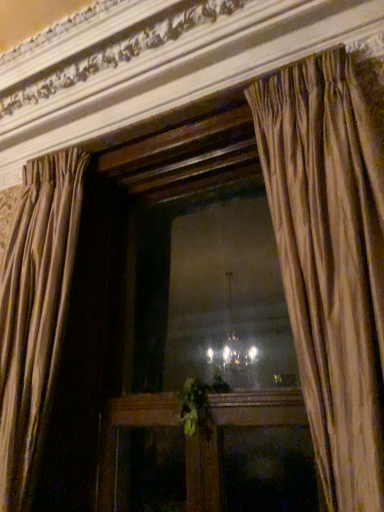
Question: From the image's perspective, is wooden frame at center located above silky beige curtain at center, the first curtain when ordered from right to left?

Choices:
 (A) yes
 (B) no

Answer: (B)

Question: Is wooden frame at center smaller than silky beige curtain at center, which is the 2th curtain in left-to-right order?

Choices:
 (A) yes
 (B) no

Answer: (A)

Question: From a real-world perspective, is wooden frame at center below silky beige curtain at center, which is the 2th curtain in left-to-right order?

Choices:
 (A) yes
 (B) no

Answer: (A)

Question: From the image's perspective, is wooden frame at center under silky beige curtain at center, which is the 2th curtain in left-to-right order?

Choices:
 (A) yes
 (B) no

Answer: (A)

Question: Considering the relative sizes of wooden frame at center and silky beige curtain at center, which is the 2th curtain in left-to-right order, in the image provided, is wooden frame at center taller than silky beige curtain at center, which is the 2th curtain in left-to-right order,?

Choices:
 (A) yes
 (B) no

Answer: (B)

Question: Would you say silky beige curtain at left, the first curtain viewed from the left, is inside or outside green leafy plant at center?

Choices:
 (A) outside
 (B) inside

Answer: (A)

Question: Based on their positions, is silky beige curtain at left, the first curtain viewed from the left, located to the left or right of green leafy plant at center?

Choices:
 (A) right
 (B) left

Answer: (B)

Question: Is point (74, 215) closer or farther from the camera than point (185, 402)?

Choices:
 (A) closer
 (B) farther

Answer: (B)

Question: From a real-world perspective, is silky beige curtain at left, the second curtain from the right, physically located above or below green leafy plant at center?

Choices:
 (A) below
 (B) above

Answer: (B)

Question: Is silky beige curtain at center, the first curtain when ordered from right to left, situated inside wooden frame at center or outside?

Choices:
 (A) inside
 (B) outside

Answer: (B)

Question: Considering the relative positions of silky beige curtain at center, which is the 2th curtain in left-to-right order, and wooden frame at center in the image provided, is silky beige curtain at center, which is the 2th curtain in left-to-right order, to the left or to the right of wooden frame at center?

Choices:
 (A) right
 (B) left

Answer: (A)

Question: In terms of size, does silky beige curtain at center, which is the 2th curtain in left-to-right order, appear bigger or smaller than wooden frame at center?

Choices:
 (A) small
 (B) big

Answer: (B)

Question: In terms of width, does silky beige curtain at center, which is the 2th curtain in left-to-right order, look wider or thinner when compared to wooden frame at center?

Choices:
 (A) wide
 (B) thin

Answer: (A)

Question: Do you think wooden frame at center is within silky beige curtain at center, which is the 2th curtain in left-to-right order, or outside of it?

Choices:
 (A) outside
 (B) inside

Answer: (A)

Question: Looking at their shapes, would you say wooden frame at center is wider or thinner than silky beige curtain at center, the first curtain when ordered from right to left?

Choices:
 (A) thin
 (B) wide

Answer: (A)